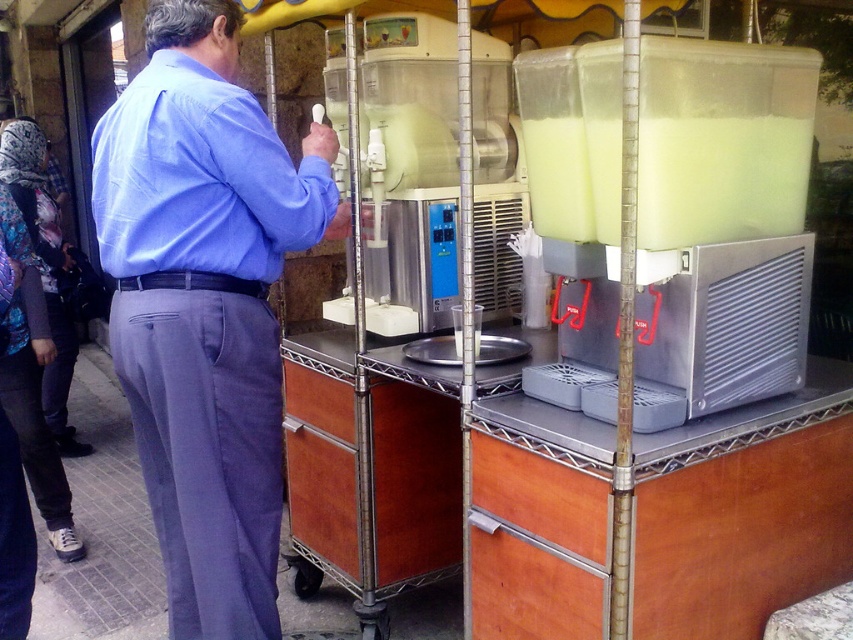
You are a customer waiting in line to order a drink. You see the blue cotton shirt at upper left and the translucent plastic container at right. Which object is closer to the ground?

The blue cotton shirt at upper left is below the translucent plastic container at right, so it is closer to the ground.

You are a delivery person standing at the camera position. You need to pick up the translucent plastic blender at right to prepare an order. Is the blender within your reach without moving your position?

The translucent plastic blender at right is 1.37 meters away from the camera, so it is out of reach for a delivery person standing at the camera position. You would need to move closer to access it.

You are a customer standing in front of the beverage cart. You see the blue cotton shirt at upper left and the translucent plastic container at right. Which object is closer to your left side?

The blue cotton shirt at upper left is closer to your left side since it is positioned on the left side of the translucent plastic container at right.